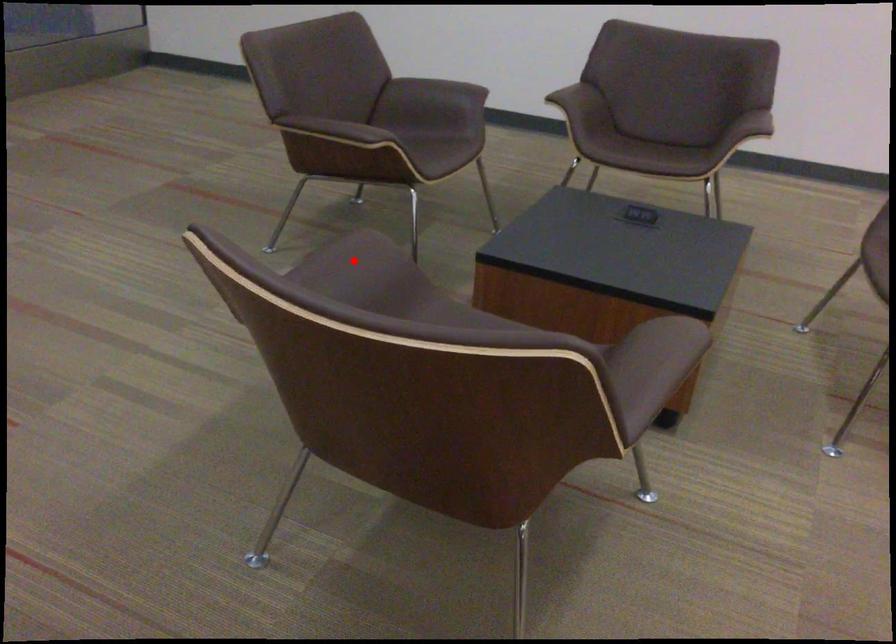
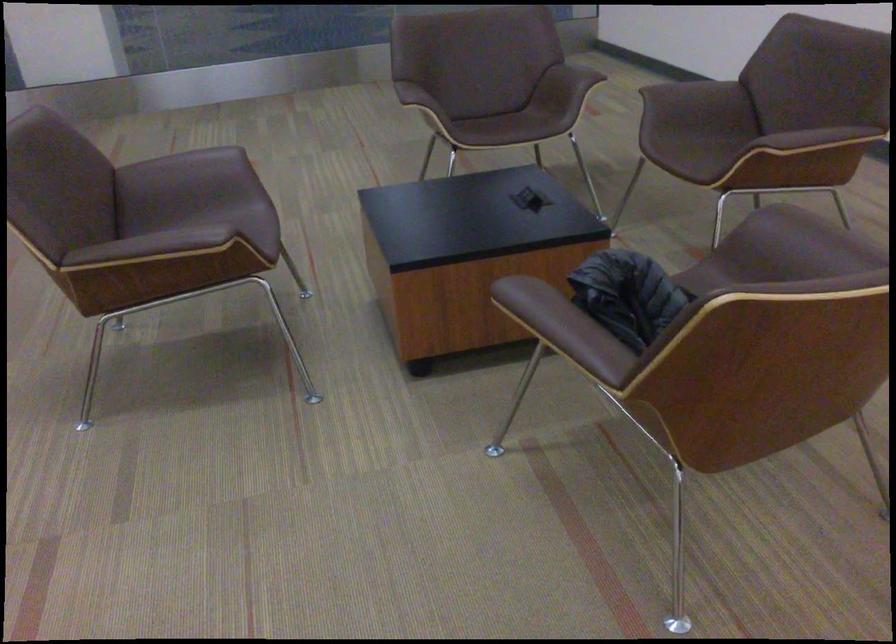
Locate, in the second image, the point that corresponds to the highlighted location in the first image.

(193, 162)